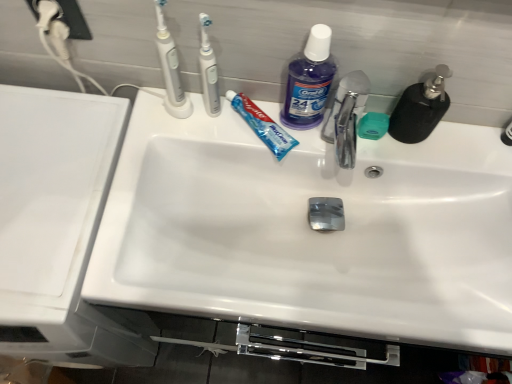
Where is `vacant space situated on the left part of purple translucent liquid at upper center`? The width and height of the screenshot is (512, 384). vacant space situated on the left part of purple translucent liquid at upper center is located at coordinates (217, 129).